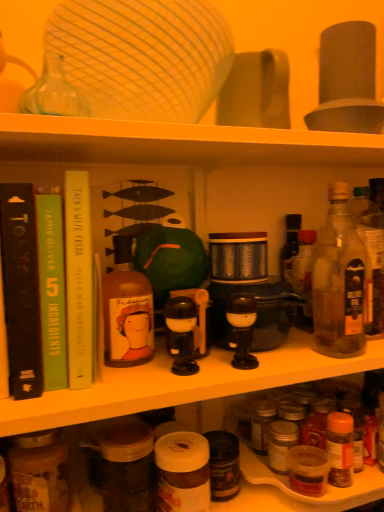
You are a GUI agent. You are given a task and a screenshot of the screen. Output one action in this format:
    pyautogui.click(x=<x>, y=<y>)
    Task: Click on the vacant area located to the right-hand side of black matte book at left, the 1th book positioned from the left
    This screenshot has height=512, width=384.
    Given the screenshot: What is the action you would take?
    pyautogui.click(x=146, y=378)